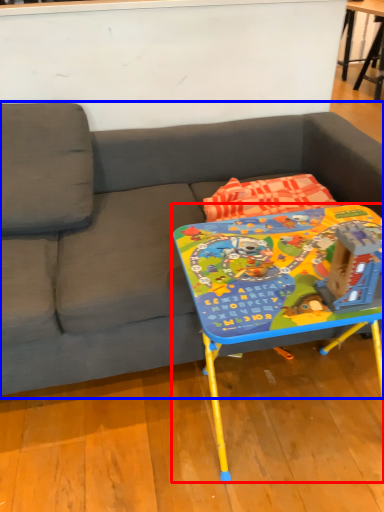
Question: Which of the following is the closest to the observer, table (highlighted by a red box) or studio couch (highlighted by a blue box)?

Choices:
 (A) table
 (B) studio couch

Answer: (B)